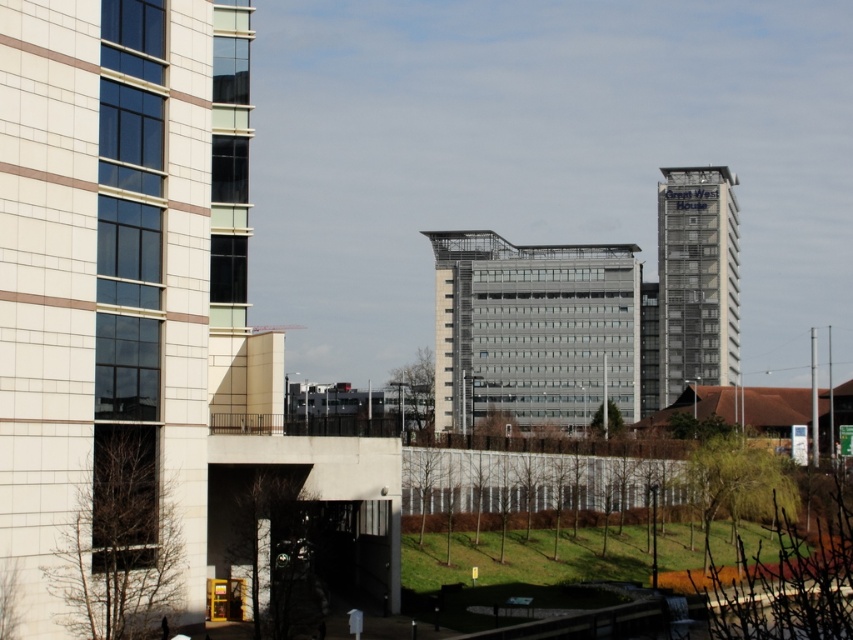
Question: Is metallic glass building at center smaller than concrete entrance at center?

Choices:
 (A) no
 (B) yes

Answer: (A)

Question: Which of the following is the closest to the observer?

Choices:
 (A) (496, 241)
 (B) (368, 548)

Answer: (B)

Question: Which is nearer to the metallic glass building at center?

Choices:
 (A) concrete entrance at center
 (B) glassy silver tower at upper right

Answer: (B)

Question: Does concrete entrance at center have a smaller size compared to glassy silver tower at upper right?

Choices:
 (A) yes
 (B) no

Answer: (A)

Question: Which object is the farthest from the metallic glass building at center?

Choices:
 (A) concrete entrance at center
 (B) glassy silver tower at upper right

Answer: (A)

Question: Is concrete entrance at center to the left of glassy silver tower at upper right from the viewer's perspective?

Choices:
 (A) no
 (B) yes

Answer: (B)